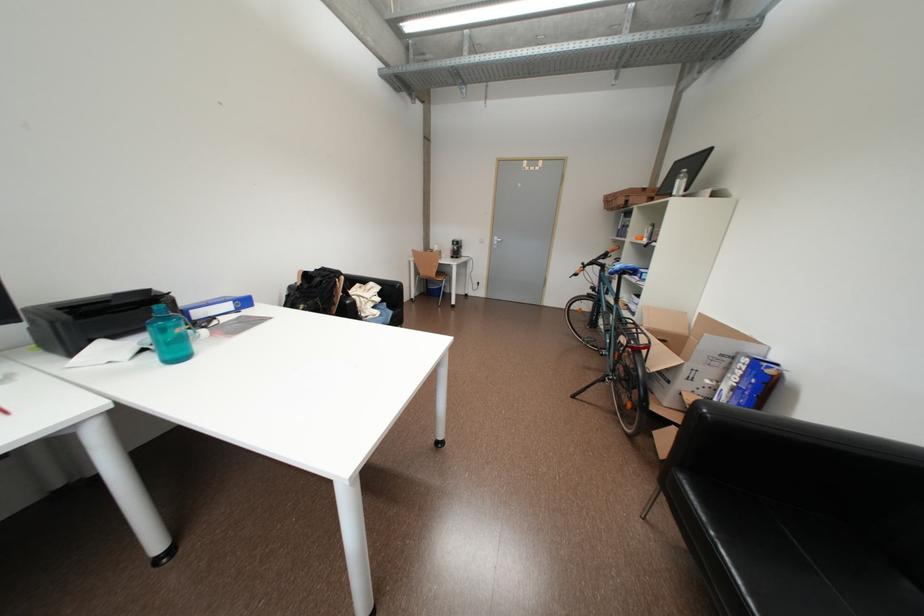
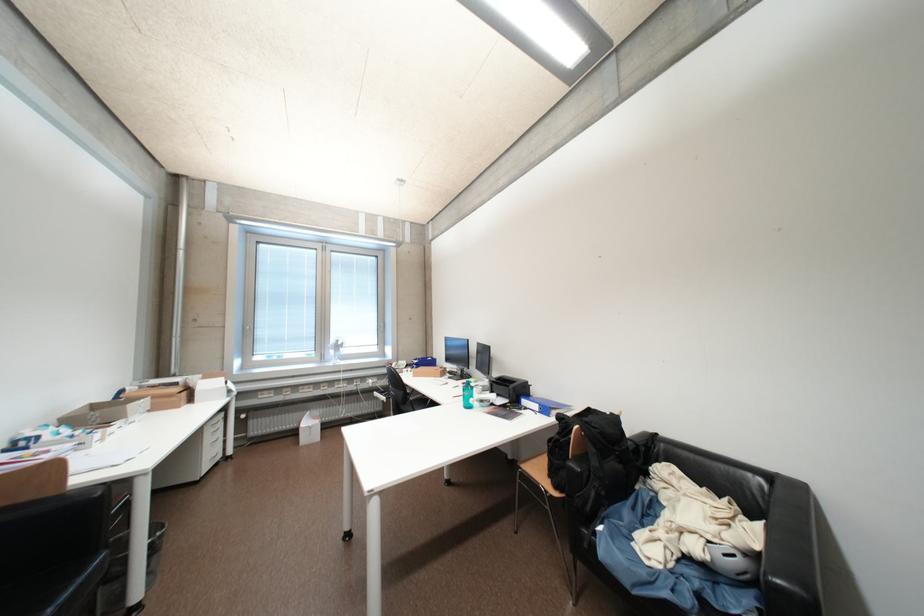
The point at [385,302] is marked in the first image. Where is the corresponding point in the second image?

(704, 551)